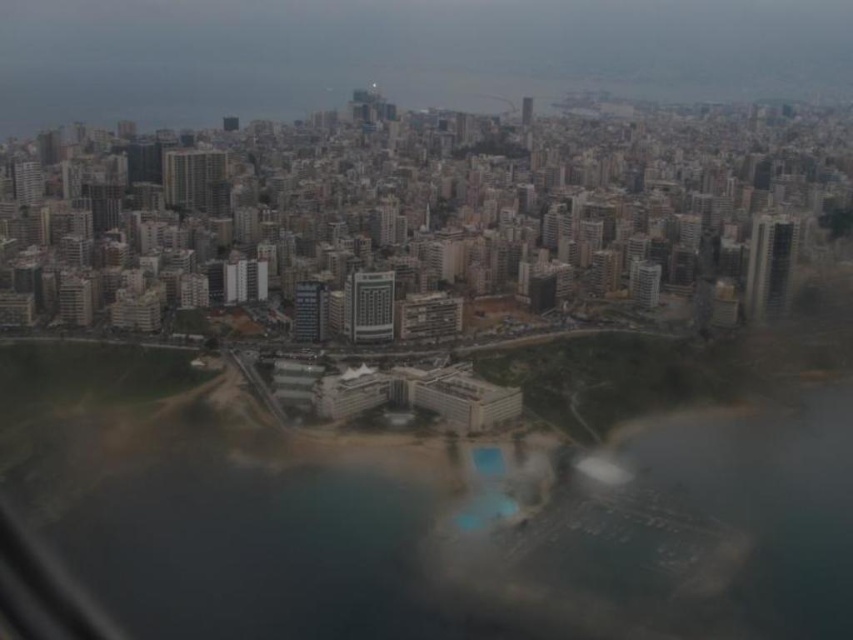
Question: Is the position of clear blue water at center more distant than that of matte glass building at center?

Choices:
 (A) yes
 (B) no

Answer: (B)

Question: Which of the following is the farthest from the observer?

Choices:
 (A) clear blue water at center
 (B) matte glass building at center

Answer: (B)

Question: Is clear blue water at center below matte glass building at center?

Choices:
 (A) no
 (B) yes

Answer: (B)

Question: Which point is closer to the camera taking this photo?

Choices:
 (A) (370, 284)
 (B) (103, 515)

Answer: (B)

Question: Is clear blue water at center positioned at the back of matte glass building at center?

Choices:
 (A) no
 (B) yes

Answer: (A)